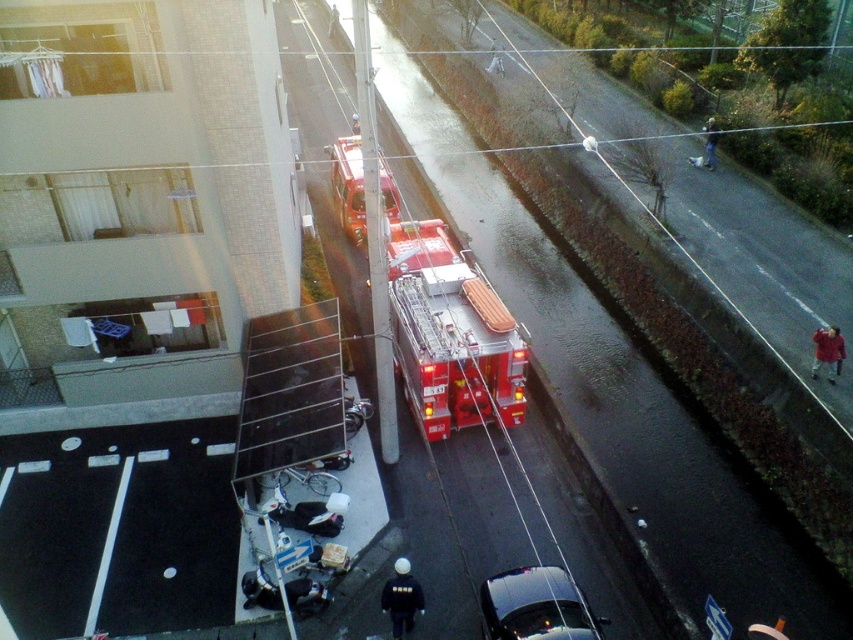
Can you confirm if shiny red fire truck at center is positioned to the left of shiny black car at lower center?

Correct, you'll find shiny red fire truck at center to the left of shiny black car at lower center.

Does shiny red fire truck at center have a greater width compared to shiny black car at lower center?

Yes, shiny red fire truck at center is wider than shiny black car at lower center.

Which is behind, point (436, 404) or point (576, 596)?

The point (436, 404) is behind.

The height and width of the screenshot is (640, 853). I want to click on shiny red fire truck at center, so click(450, 330).